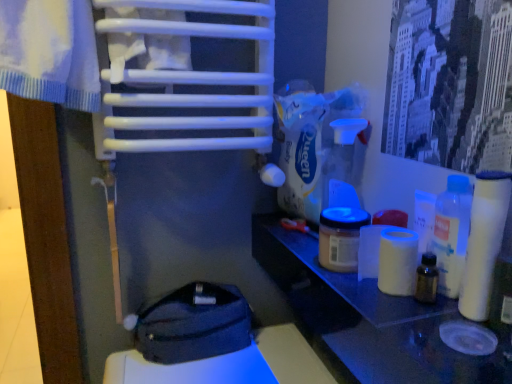
Locate an element on the screen. This screenshot has height=384, width=512. vacant space in front of white matte toilet paper at right, which appears as the 1th toilet paper when viewed from the left is located at coordinates (412, 330).